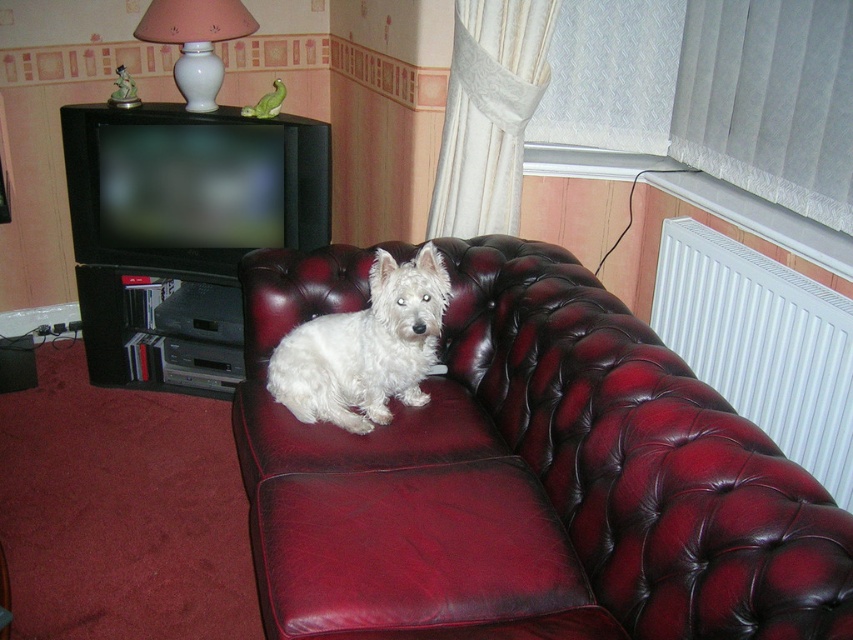
You are a guest in the living room and want to pet the white fur dog at center. To reach it, you need to walk around the white ceramic lamp at upper center. Which direction should you move relative to the lamp?

The white fur dog at center is to the right of the white ceramic lamp at upper center, so you should move to the right of the lamp to reach the dog.

You are a guest in this living room and want to know if you can place a 1.2 meter tall potted plant between the white plastic radiator at upper right and the white fur dog at center without blocking the TV. Can you do that?

The white plastic radiator at upper right is taller than the white fur dog at center. However, the question about placing a 1.2 meter tall potted plant between them requires knowing the distance between the two objects. Since the scene description does not provide spatial measurements between the radiator and the dog, it is impossible to determine if the plant would block the TV or fit in the space available.